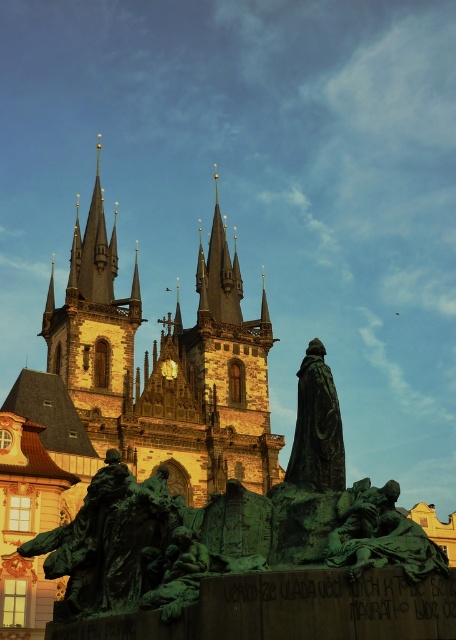
Question: Can you confirm if green patinated bronze statue at center is thinner than bronze statue at center?

Choices:
 (A) yes
 (B) no

Answer: (B)

Question: Which object is farther from the camera taking this photo?

Choices:
 (A) golden stone spires at upper left
 (B) polished gold spire at center
 (C) bronze statue at center
 (D) green patinated bronze statue at center

Answer: (B)

Question: Which point appears farthest from the camera in this image?

Choices:
 (A) (353, 540)
 (B) (327, 454)
 (C) (222, 243)

Answer: (C)

Question: Is green patinated bronze statue at center below bronze statue at center?

Choices:
 (A) yes
 (B) no

Answer: (A)

Question: Among these points, which one is nearest to the camera?

Choices:
 (A) (52, 307)
 (B) (345, 531)
 (C) (207, 273)

Answer: (B)

Question: Observing the image, what is the correct spatial positioning of golden stone spires at upper left in reference to green patinated bronze statue at center?

Choices:
 (A) left
 (B) right

Answer: (A)